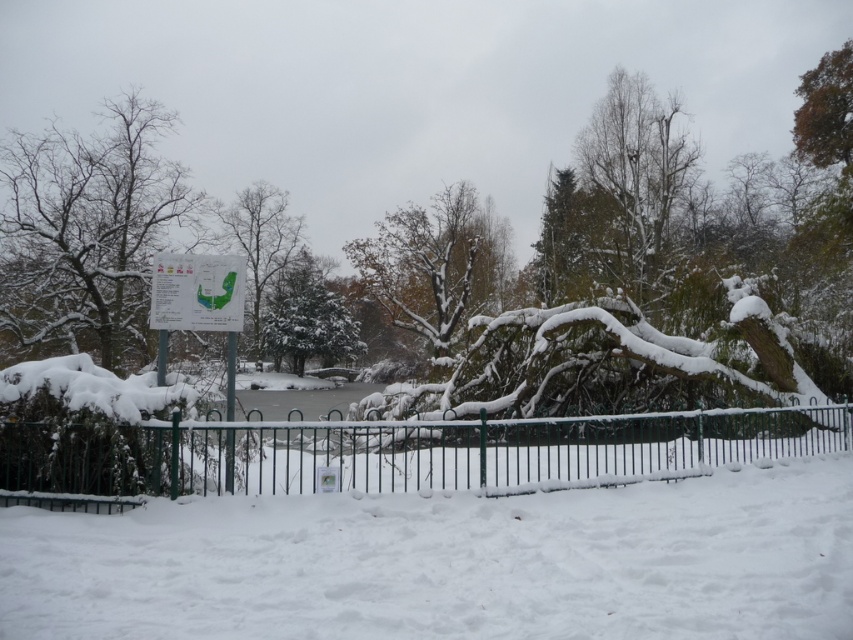
Question: Which of the following is the closest to the observer?

Choices:
 (A) white paper sign at upper left
 (B) snow-covered tree at center
 (C) green metal fence at center

Answer: (C)

Question: Which object is the closest to the snow-covered bare tree at left?

Choices:
 (A) snow-covered tree at center
 (B) white paper sign at upper left
 (C) white fluffy snow at lower center
 (D) green textured tree at center

Answer: (A)

Question: Which point is closer to the camera?

Choices:
 (A) snow-covered tree at center
 (B) brown textured tree at upper right
 (C) white paper sign at upper left
 (D) green textured tree at center

Answer: (C)

Question: Is green textured tree at center above brown textured tree at upper right?

Choices:
 (A) no
 (B) yes

Answer: (A)

Question: Can you confirm if white snow-covered tree at center is wider than white paper sign at upper left?

Choices:
 (A) yes
 (B) no

Answer: (A)

Question: Is white paper sign at upper left positioned in front of brown textured tree at upper right?

Choices:
 (A) no
 (B) yes

Answer: (B)